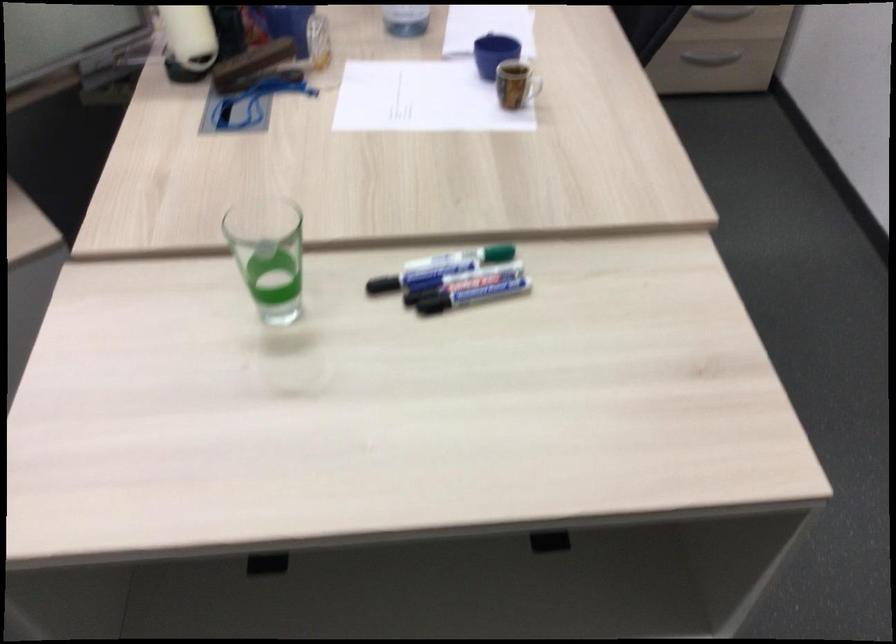
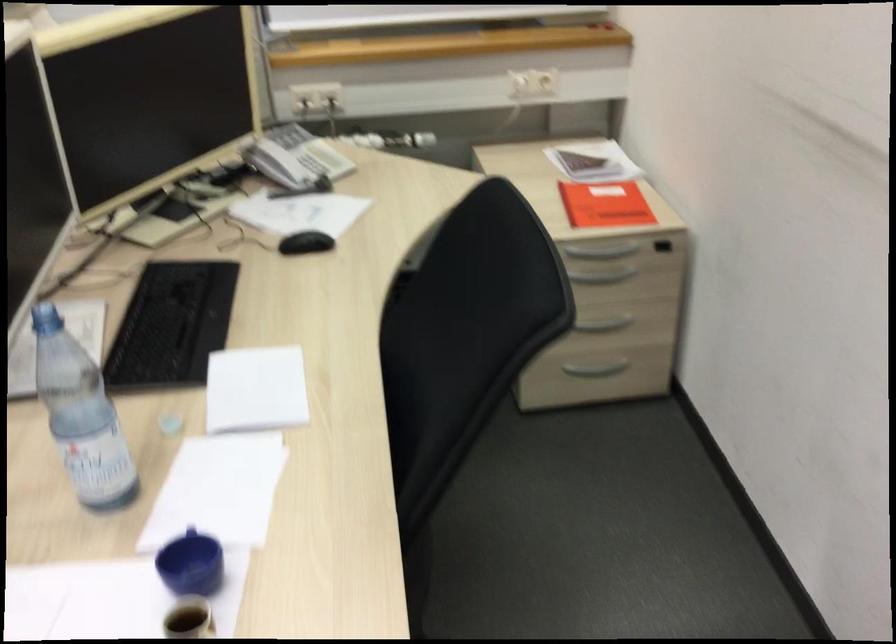
Question: The first image is from the beginning of the video and the second image is from the end. How did the camera likely rotate when shooting the video?

Choices:
 (A) Left
 (B) Right
 (C) Up
 (D) Down

Answer: (C)